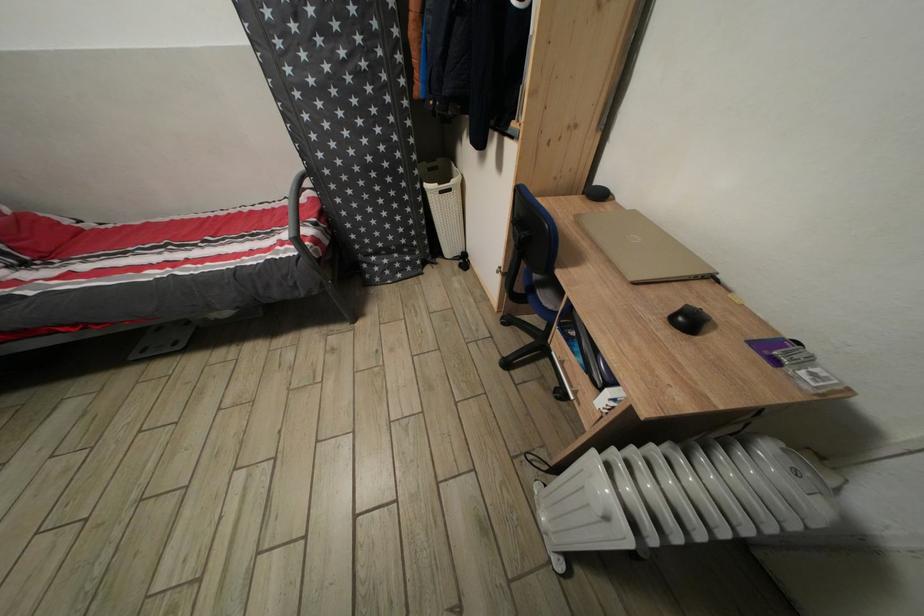
The image size is (924, 616). Identify the location of bed frame armrest. (297, 201).